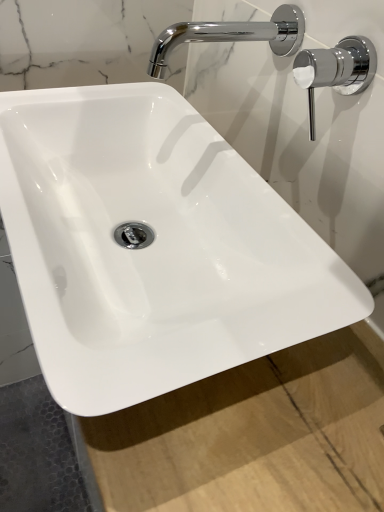
What do you see at coordinates (232, 35) in the screenshot?
I see `chrome/metallic faucet at upper right` at bounding box center [232, 35].

This screenshot has height=512, width=384. What are the coordinates of `chrome/metallic faucet at upper right` in the screenshot? It's located at (232, 35).

Identify the location of chrome/metallic faucet at upper right. This screenshot has height=512, width=384. (336, 70).

What do you see at coordinates (336, 70) in the screenshot? I see `chrome/metallic faucet at upper right` at bounding box center [336, 70].

This screenshot has width=384, height=512. Find the location of `chrome/metallic faucet at upper right`. chrome/metallic faucet at upper right is located at coordinates (232, 35).

Is chrome/metallic faucet at upper right to the right of chrome/metallic faucet at upper right from the viewer's perspective?

Indeed, chrome/metallic faucet at upper right is positioned on the right side of chrome/metallic faucet at upper right.

Does chrome/metallic faucet at upper right lie behind chrome/metallic faucet at upper right?

That is False.

Is point (329, 69) behind point (298, 29)?

That is False.

From the image's perspective, which one is positioned lower, chrome/metallic faucet at upper right or chrome/metallic faucet at upper right?

From the image's view, chrome/metallic faucet at upper right is below.

From the picture: From a real-world perspective, who is located higher, chrome/metallic faucet at upper right or chrome/metallic faucet at upper right?

chrome/metallic faucet at upper right, from a real-world perspective.

Which object is wider, chrome/metallic faucet at upper right or chrome/metallic faucet at upper right?

chrome/metallic faucet at upper right.

Does chrome/metallic faucet at upper right have a lesser height compared to chrome/metallic faucet at upper right?

Yes.

Considering the relative sizes of chrome/metallic faucet at upper right and chrome/metallic faucet at upper right in the image provided, is chrome/metallic faucet at upper right bigger than chrome/metallic faucet at upper right?

No.

Would you say chrome/metallic faucet at upper right is inside or outside chrome/metallic faucet at upper right?

chrome/metallic faucet at upper right is spatially situated outside chrome/metallic faucet at upper right.

Is there a large distance between chrome/metallic faucet at upper right and chrome/metallic faucet at upper right?

No, chrome/metallic faucet at upper right is in close proximity to chrome/metallic faucet at upper right.

Does chrome/metallic faucet at upper right turn towards chrome/metallic faucet at upper right?

No, chrome/metallic faucet at upper right is not turned towards chrome/metallic faucet at upper right.

How different are the orientations of chrome/metallic faucet at upper right and chrome/metallic faucet at upper right in degrees?

The facing directions of chrome/metallic faucet at upper right and chrome/metallic faucet at upper right are 0.00123 degrees apart.

The height and width of the screenshot is (512, 384). What are the coordinates of `tap behind the chrome/metallic faucet at upper right` in the screenshot? It's located at (232, 35).

Based on the photo, is chrome/metallic faucet at upper right to the left of chrome/metallic faucet at upper right from the viewer's perspective?

Indeed, chrome/metallic faucet at upper right is positioned on the left side of chrome/metallic faucet at upper right.

Is chrome/metallic faucet at upper right further to the viewer compared to chrome/metallic faucet at upper right?

Yes, chrome/metallic faucet at upper right is further from the camera.

Does point (283, 48) appear closer or farther from the camera than point (299, 64)?

Point (283, 48).

From the image's perspective, does chrome/metallic faucet at upper right appear lower than chrome/metallic faucet at upper right?

Actually, chrome/metallic faucet at upper right appears above chrome/metallic faucet at upper right in the image.

From a real-world perspective, does chrome/metallic faucet at upper right sit lower than chrome/metallic faucet at upper right?

No, from a real-world perspective, chrome/metallic faucet at upper right is not beneath chrome/metallic faucet at upper right.

Considering the sizes of chrome/metallic faucet at upper right and chrome/metallic faucet at upper right in the image, is chrome/metallic faucet at upper right wider or thinner than chrome/metallic faucet at upper right?

Clearly, chrome/metallic faucet at upper right has more width compared to chrome/metallic faucet at upper right.

Between chrome/metallic faucet at upper right and chrome/metallic faucet at upper right, which one has less height?

chrome/metallic faucet at upper right is shorter.

Considering the relative sizes of chrome/metallic faucet at upper right and chrome/metallic faucet at upper right in the image provided, is chrome/metallic faucet at upper right smaller than chrome/metallic faucet at upper right?

No.

Choose the correct answer: Is chrome/metallic faucet at upper right inside chrome/metallic faucet at upper right or outside it?

chrome/metallic faucet at upper right lies outside chrome/metallic faucet at upper right.

Would you consider chrome/metallic faucet at upper right to be distant from chrome/metallic faucet at upper right?

Actually, chrome/metallic faucet at upper right and chrome/metallic faucet at upper right are a little close together.

Is chrome/metallic faucet at upper right at the back of chrome/metallic faucet at upper right?

chrome/metallic faucet at upper right does not have its back to chrome/metallic faucet at upper right.

Can you tell me how much chrome/metallic faucet at upper right and chrome/metallic faucet at upper right differ in facing direction?

0.00123 degrees separate the facing orientations of chrome/metallic faucet at upper right and chrome/metallic faucet at upper right.

Where is `tap above the chrome/metallic faucet at upper right (from a real-world perspective)`? tap above the chrome/metallic faucet at upper right (from a real-world perspective) is located at coordinates tap(232, 35).

Where is `door handle below the chrome/metallic faucet at upper right (from the image's perspective)`? The image size is (384, 512). door handle below the chrome/metallic faucet at upper right (from the image's perspective) is located at coordinates (336, 70).

Find the location of a particular element. tap located on the left of chrome/metallic faucet at upper right is located at coordinates (232, 35).